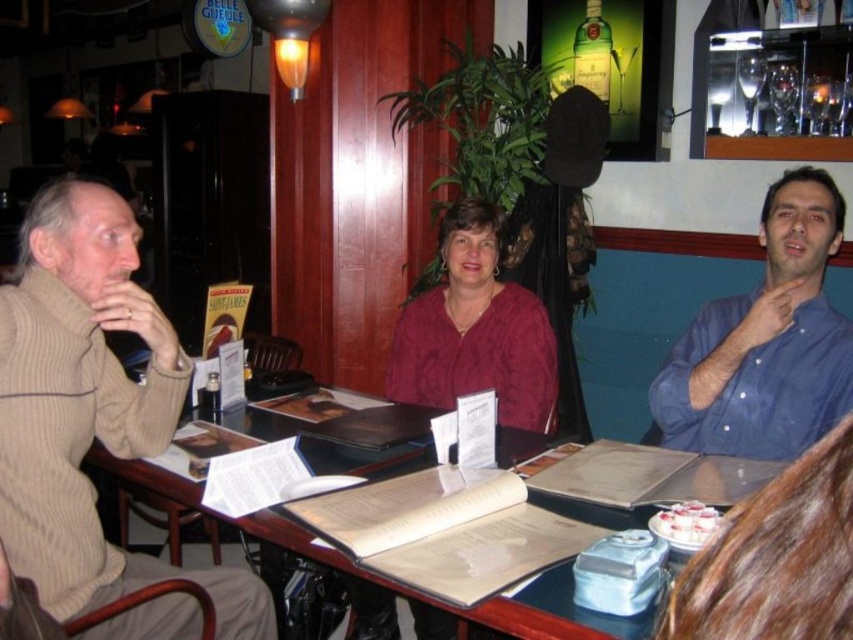
Question: Among these points, which one is farthest from the camera?

Choices:
 (A) (439, 636)
 (B) (809, 301)
 (C) (538, 636)

Answer: (A)

Question: Can you confirm if beige ribbed sweater at left is wider than maroon sweater at center?

Choices:
 (A) no
 (B) yes

Answer: (A)

Question: Based on their relative distances, which object is farther from the beige ribbed sweater at left?

Choices:
 (A) knitted maroon sweater at center
 (B) blue button-down shirt at right
 (C) maroon sweater at center
 (D) wooden table at center

Answer: (B)

Question: Does beige ribbed sweater at left appear over blue button-down shirt at right?

Choices:
 (A) yes
 (B) no

Answer: (B)

Question: Is knitted maroon sweater at center further to camera compared to wooden table at center?

Choices:
 (A) no
 (B) yes

Answer: (B)

Question: Which of the following is the closest to the observer?

Choices:
 (A) knitted maroon sweater at center
 (B) beige ribbed sweater at left
 (C) blue button-down shirt at right

Answer: (B)